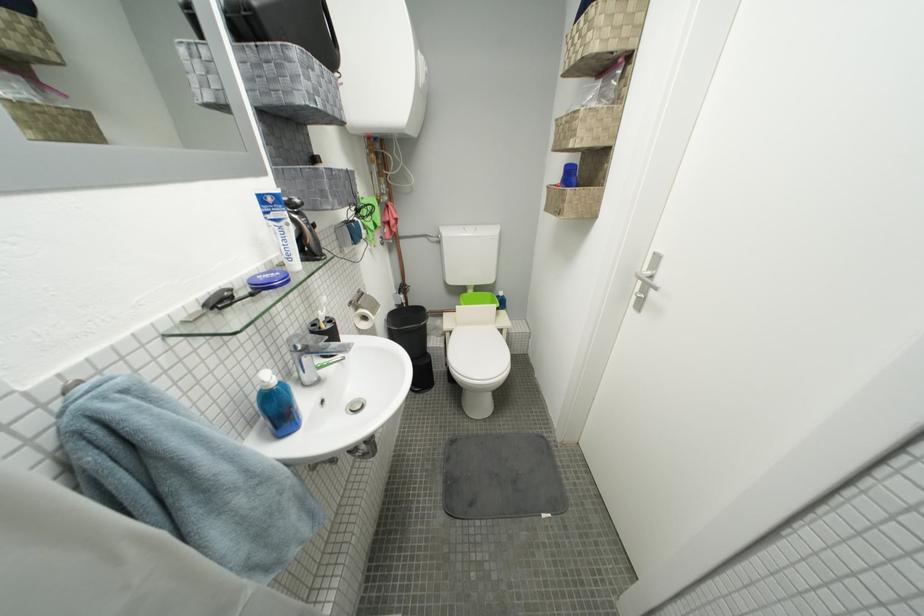
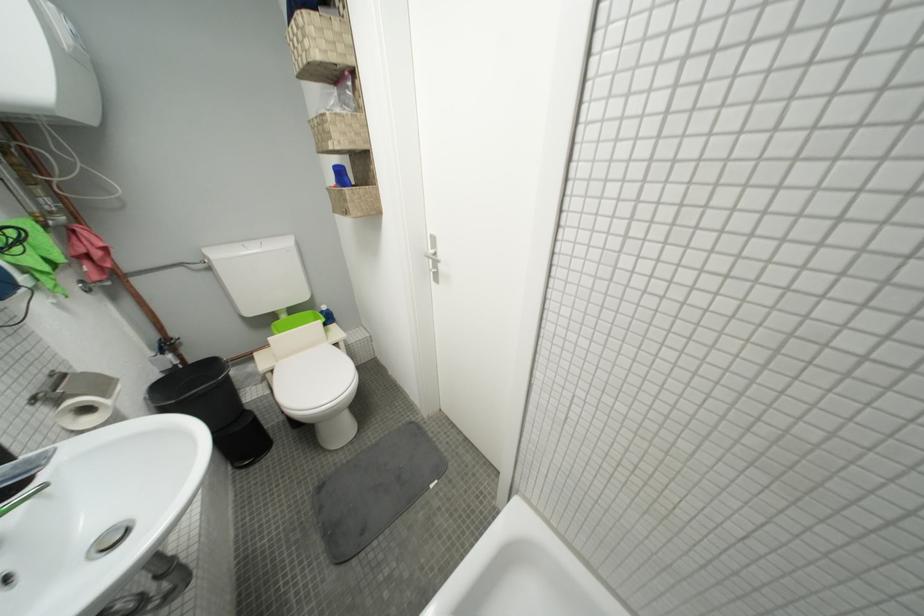
In the second image, find the point that corresponds to pixel 479 236 in the first image.

(262, 252)